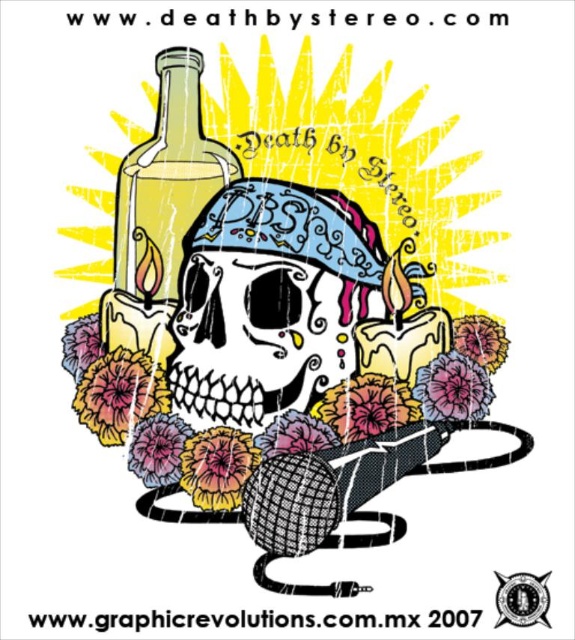
Is black painted skull at center bigger than translucent glass bottle at upper left?

Actually, black painted skull at center might be smaller than translucent glass bottle at upper left.

Which is behind, point (250, 282) or point (201, 182)?

The point (250, 282) is more distant.

Who is more forward, (283,342) or (185,154)?

Point (185,154) is in front.

Find the location of a particular element. The height and width of the screenshot is (640, 575). black painted skull at center is located at coordinates (258, 337).